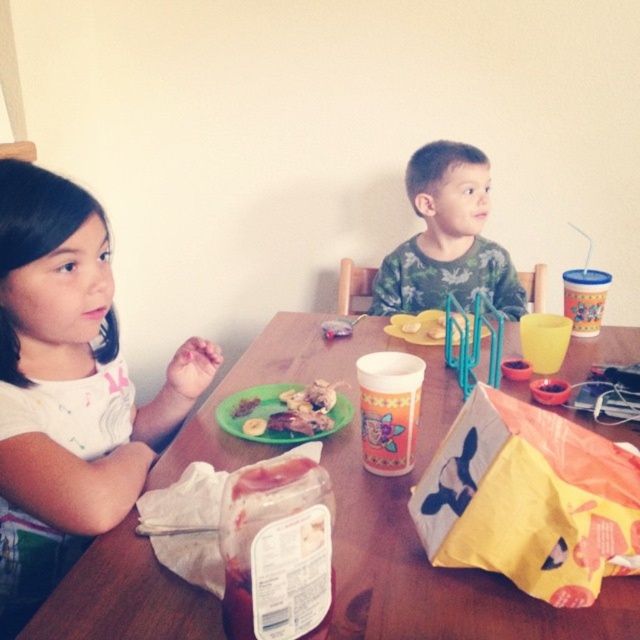
You are standing 30 inches away from the table. If you want to touch the point at coordinates point (449, 579), will you be able to reach it without moving closer?

The distance of point (449, 579) from viewer is 26.06 inches. Since you are 30 inches away from the table, you are farther than the required distance, so you can reach the point without moving closer.